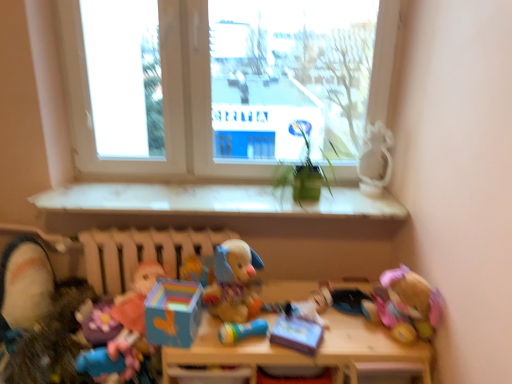
Locate an element on the screen. The height and width of the screenshot is (384, 512). vacant area to the right of matte cardboard box at center, which ranks as the 3th toy in right-to-left order is located at coordinates (346, 336).